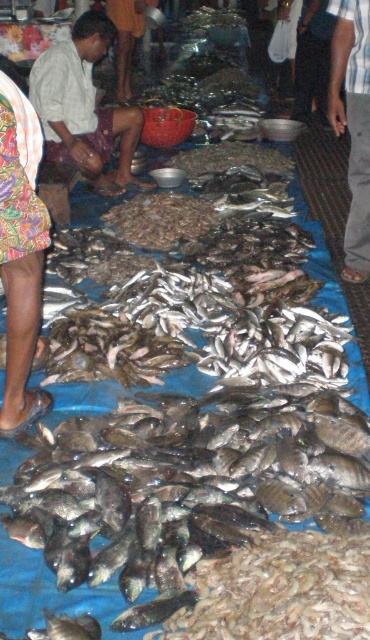
Is shiny dark fish at center taller than printed fabric skirt at lower left?

In fact, shiny dark fish at center may be shorter than printed fabric skirt at lower left.

Who is positioned more to the left, shiny dark fish at center or printed fabric skirt at lower left?

printed fabric skirt at lower left is more to the left.

Who is more forward, (207, 586) or (5, 408)?

Positioned in front is point (207, 586).

Find the location of a particular element. shiny dark fish at center is located at coordinates coord(169,497).

Which is in front, point (82, 118) or point (348, 8)?

Point (348, 8) is in front.

Who is shorter, brown woven cloth at left or striped shirt at center?

brown woven cloth at left

Who is more forward, (102, 138) or (357, 115)?

Positioned in front is point (357, 115).

You are a GUI agent. You are given a task and a screenshot of the screen. Output one action in this format:
    pyautogui.click(x=<x>, y=<y>)
    Task: Click on the brown woven cloth at left
    The width and height of the screenshot is (370, 640).
    Given the screenshot: What is the action you would take?
    pyautogui.click(x=82, y=104)

How distant is shiny dark fish at center from striped shirt at center?

shiny dark fish at center and striped shirt at center are 7.36 feet apart.

Who is more forward, (153,540) or (334,48)?

Point (153,540) is more forward.

This screenshot has width=370, height=640. I want to click on shiny dark fish at center, so click(x=169, y=497).